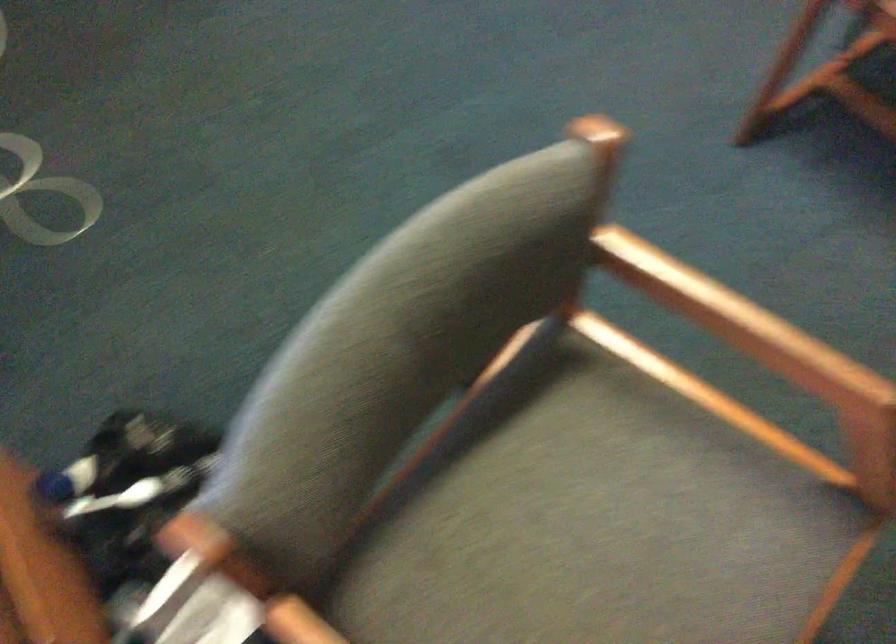
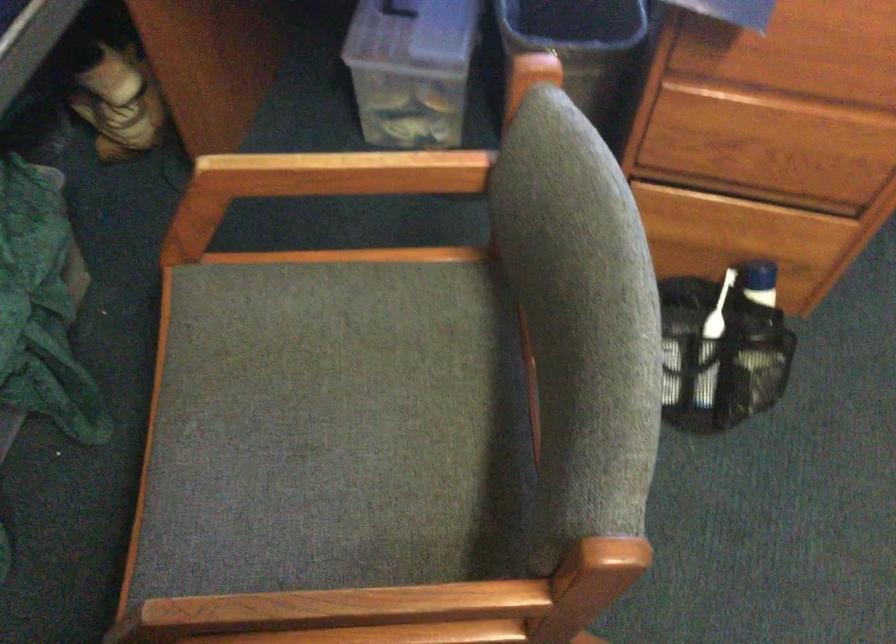
The point at (765, 337) is marked in the first image. Where is the corresponding point in the second image?

(338, 611)